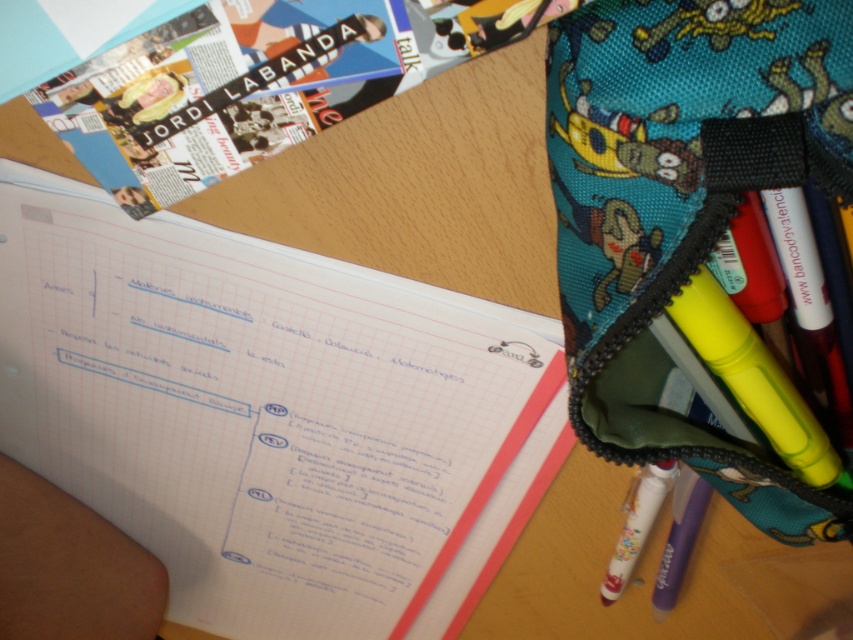
Who is positioned more to the left, white grid paper at upper left or teal fabric pencil case at right?

white grid paper at upper left

Does white grid paper at upper left have a lesser height compared to teal fabric pencil case at right?

Incorrect, white grid paper at upper left's height does not fall short of teal fabric pencil case at right's.

Measure the distance between white grid paper at upper left and camera.

white grid paper at upper left is 21.62 inches away from camera.

Find the location of `white grid paper at upper left`. white grid paper at upper left is located at coordinates (270, 413).

Is teal fabric pencil case at right further to camera compared to white matte pen at lower right?

No, teal fabric pencil case at right is closer to the viewer.

In the scene shown: Is teal fabric pencil case at right wider than white matte pen at lower right?

Correct, the width of teal fabric pencil case at right exceeds that of white matte pen at lower right.

Does point (693, 237) come behind point (634, 516)?

That is False.

Find the location of `teal fabric pencil case at right`. teal fabric pencil case at right is located at coordinates (683, 205).

Which is below, teal fabric pencil case at right or matte purple pen at lower right?

Positioned lower is matte purple pen at lower right.

Find the location of a particular element. This screenshot has height=640, width=853. teal fabric pencil case at right is located at coordinates (683, 205).